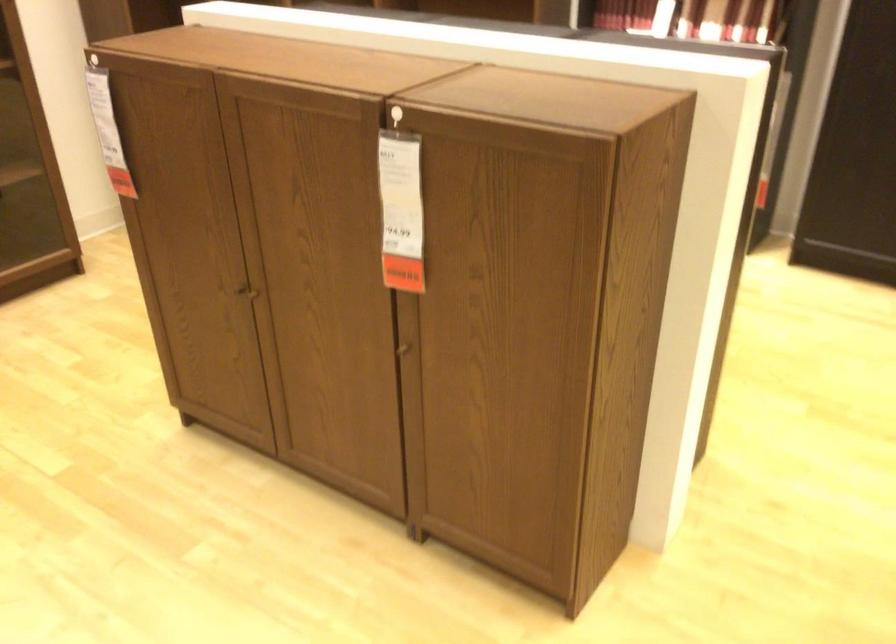
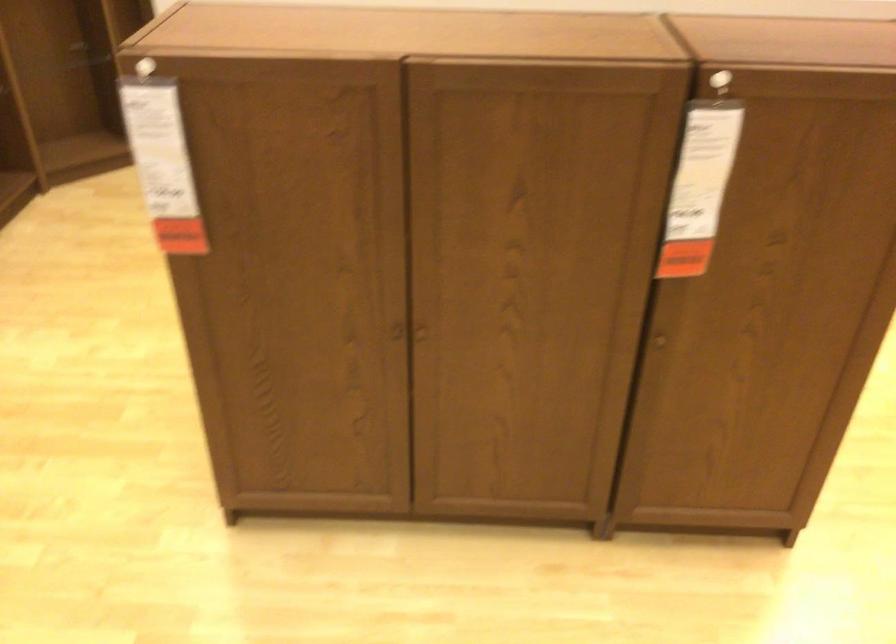
Find the pixel in the second image that matches point 407,348 in the first image.

(659, 341)